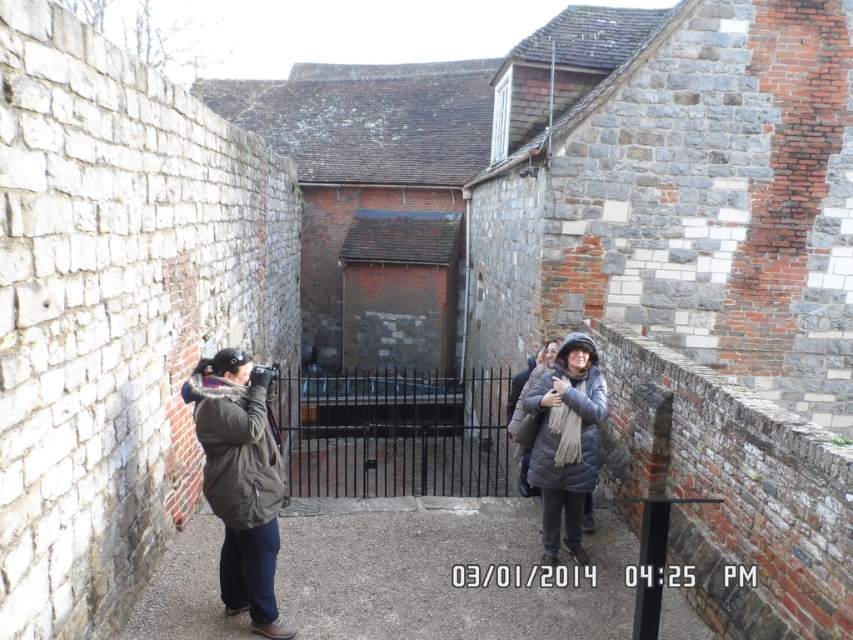
Where is `dark green jacket at center`? The height and width of the screenshot is (640, 853). dark green jacket at center is located at coordinates (241, 481).

In the scene shown: Between dark green jacket at center and matte gray coat at center, which one is positioned higher?

matte gray coat at center is higher up.

Describe the element at coordinates (241, 481) in the screenshot. I see `dark green jacket at center` at that location.

The width and height of the screenshot is (853, 640). I want to click on dark green jacket at center, so click(241, 481).